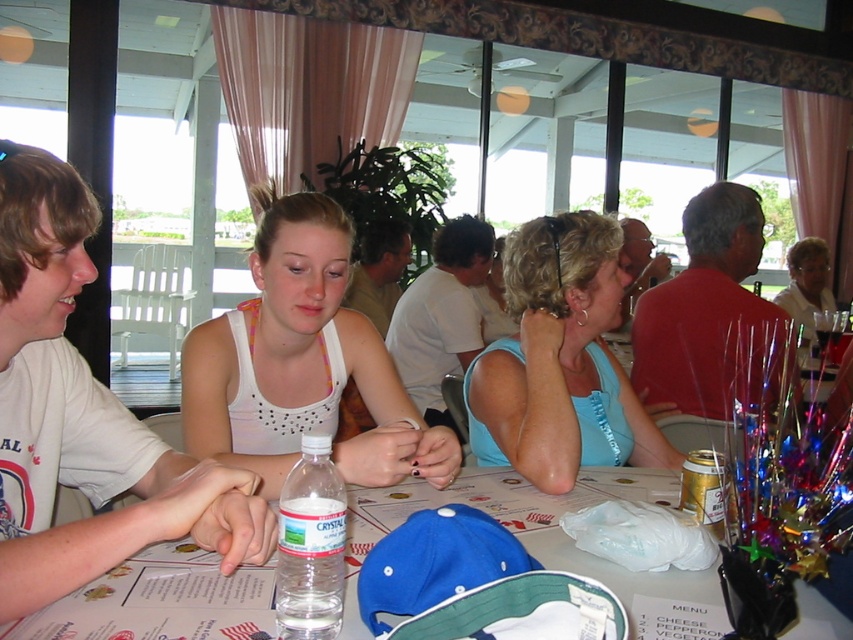
Question: Which of these objects is positioned farthest from the light blue fabric tank top at center?

Choices:
 (A) white matte tank top at center
 (B) white paper menu at center
 (C) clear plastic water bottle at center

Answer: (C)

Question: Is white matte tank top at center positioned in front of clear plastic water bottle at center?

Choices:
 (A) yes
 (B) no

Answer: (B)

Question: Which object is the closest to the white matte tank top at center?

Choices:
 (A) light blue fabric tank top at center
 (B) clear plastic water bottle at center

Answer: (A)

Question: Is white paper menu at center positioned in front of clear plastic water bottle at center?

Choices:
 (A) yes
 (B) no

Answer: (B)

Question: Can you confirm if white paper menu at center is positioned below clear plastic water bottle at center?

Choices:
 (A) no
 (B) yes

Answer: (B)

Question: Estimate the real-world distances between objects in this image. Which object is closer to the light blue fabric tank top at center?

Choices:
 (A) white paper menu at center
 (B) white matte tank top at center

Answer: (A)